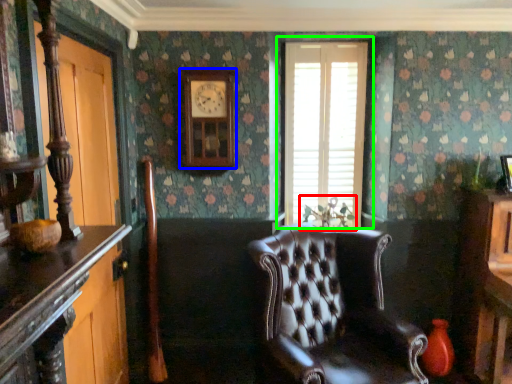
Question: Which object is positioned farthest from plant (highlighted by a red box)? Select from clock (highlighted by a blue box) and window (highlighted by a green box).

Choices:
 (A) clock
 (B) window

Answer: (A)